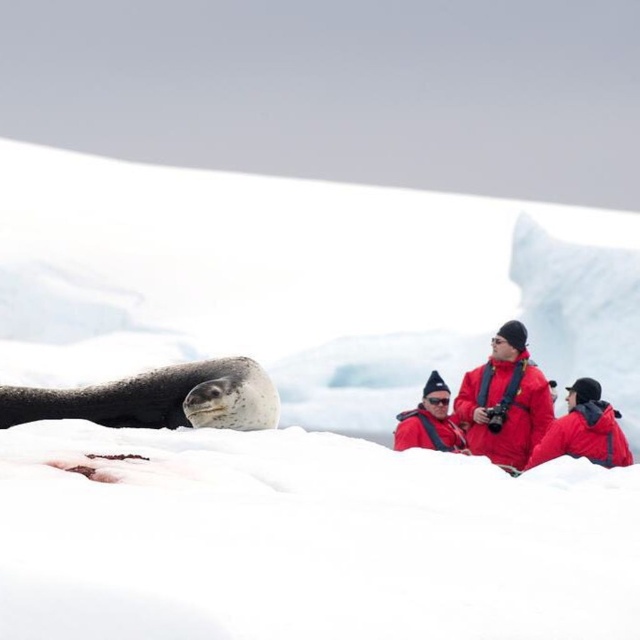
Is red down jacket at center smaller than matte red jacket at center?

Incorrect, red down jacket at center is not smaller in size than matte red jacket at center.

Is red down jacket at center to the right of matte red jacket at center from the viewer's perspective?

Yes, red down jacket at center is to the right of matte red jacket at center.

Describe the element at coordinates (504, 401) in the screenshot. I see `red down jacket at center` at that location.

Where is `red down jacket at center`? red down jacket at center is located at coordinates (504, 401).

Can you confirm if speckled fur seal at lower left is bigger than red matte jacket at center?

Indeed, speckled fur seal at lower left has a larger size compared to red matte jacket at center.

Between speckled fur seal at lower left and red matte jacket at center, which one appears on the left side from the viewer's perspective?

speckled fur seal at lower left

What do you see at coordinates (157, 397) in the screenshot? I see `speckled fur seal at lower left` at bounding box center [157, 397].

Where is `speckled fur seal at lower left`? speckled fur seal at lower left is located at coordinates (157, 397).

Which of these two, red matte jacket at center or matte red jacket at center, stands shorter?

matte red jacket at center is shorter.

Is red matte jacket at center taller than matte red jacket at center?

Yes.

From the picture: Who is more forward, (605, 412) or (426, 436)?

Positioned in front is point (605, 412).

The width and height of the screenshot is (640, 640). Find the location of `red matte jacket at center`. red matte jacket at center is located at coordinates (584, 429).